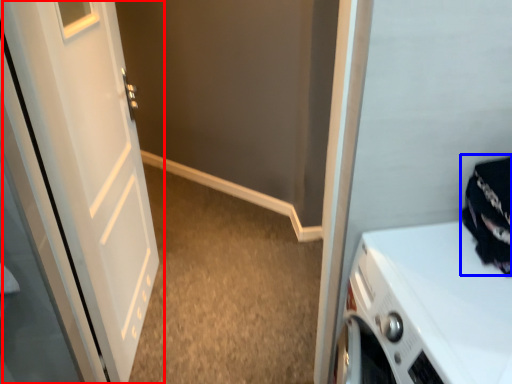
Question: Among these objects, which one is nearest to the camera, door (highlighted by a red box) or clothing (highlighted by a blue box)?

Choices:
 (A) door
 (B) clothing

Answer: (B)